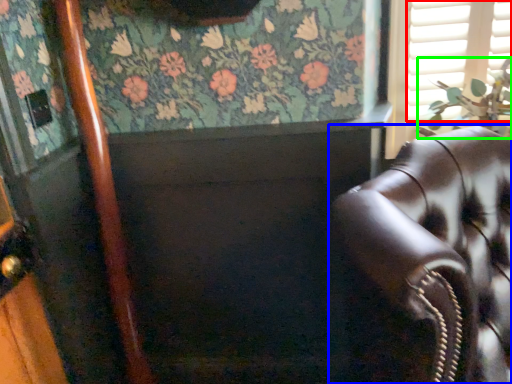
Question: Which object is positioned closest to shutter (highlighted by a red box)? Select from chair (highlighted by a blue box) and plant (highlighted by a green box).

Choices:
 (A) chair
 (B) plant

Answer: (B)